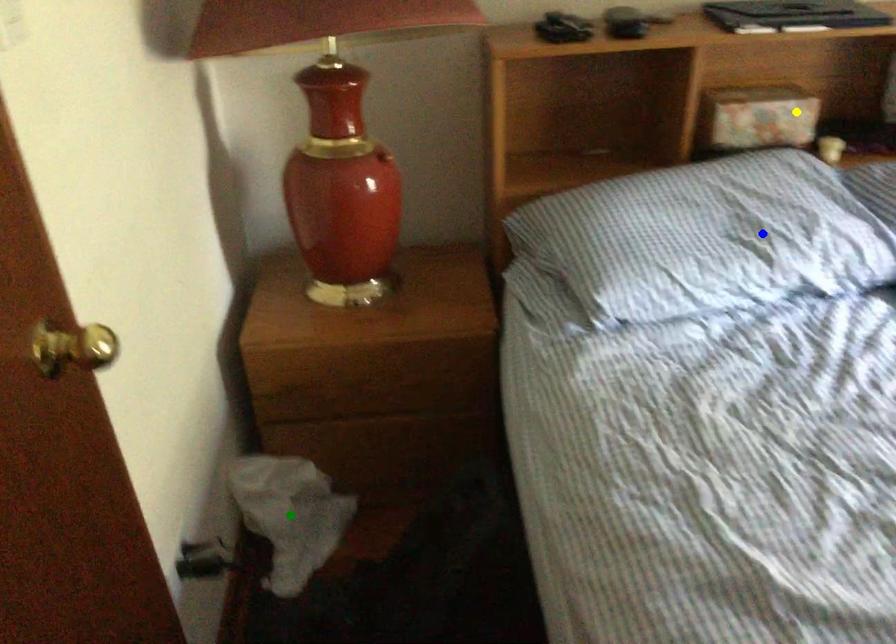
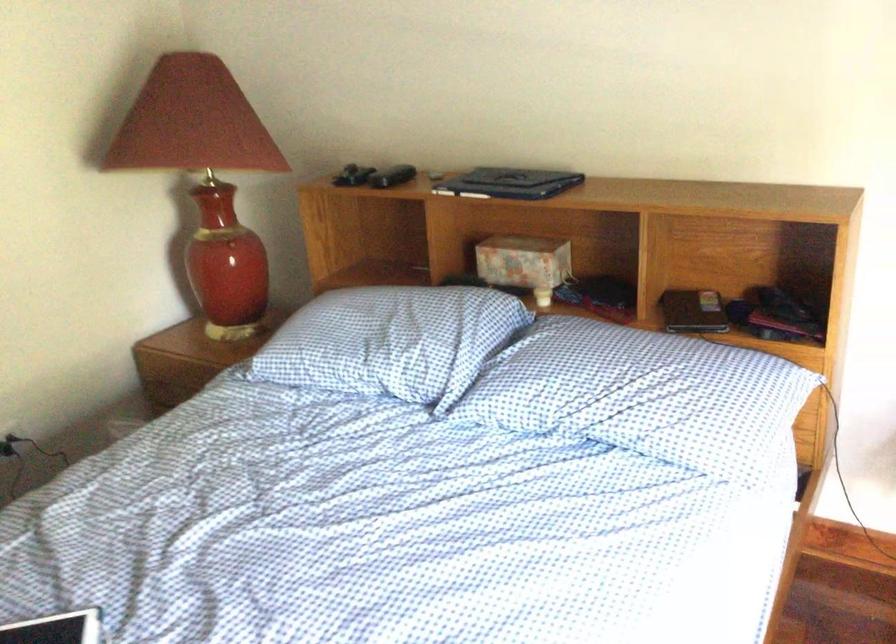
I am providing you with two images of the same scene from different viewpoints. Three points are marked in image1. Which point corresponds to a part or object that is occluded in image2?In image1, three points are marked. Which of them correspond to a part or object that is occluded in image2?Among the three points shown in image1, which one corresponds to a part or object that is no longer visible due to occlusion in image2?

green point